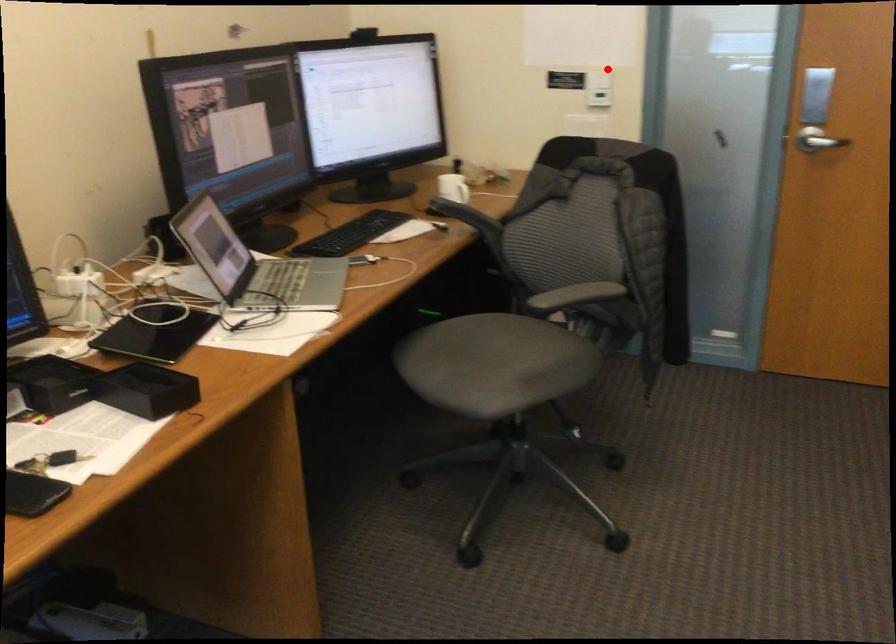
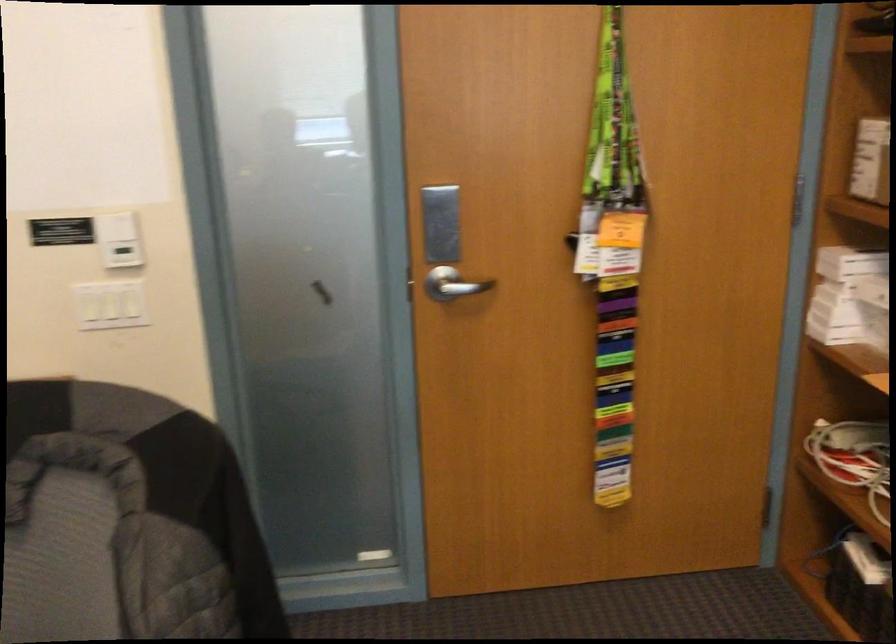
Question: I am providing you with two images of the same scene from different viewpoints. Given a red point in image1, look at the same physical point in image2. Is it:

Choices:
 (A) Closer to the viewpoint
 (B) Farther from the viewpoint

Answer: (A)